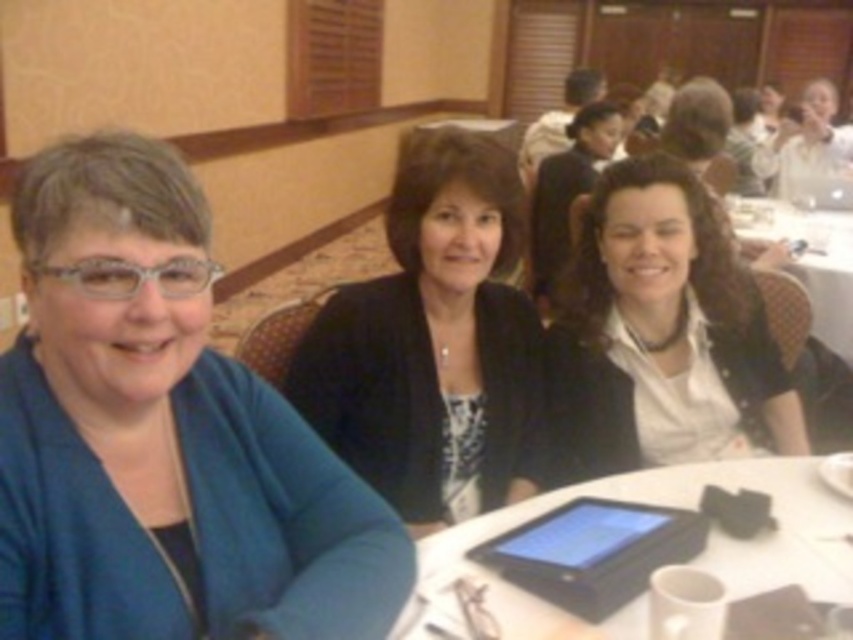
Question: Among these points, which one is farthest from the camera?

Choices:
 (A) (492, 140)
 (B) (596, 300)

Answer: (B)

Question: Can you confirm if black matte blazer at center is smaller than matte black jacket at center?

Choices:
 (A) yes
 (B) no

Answer: (A)

Question: Which object is closer to the camera taking this photo?

Choices:
 (A) white glossy hair at upper right
 (B) white matte shirt at center
 (C) white glossy table at center

Answer: (B)

Question: Is black matte tablet at center above matte black jacket at center?

Choices:
 (A) no
 (B) yes

Answer: (A)

Question: Is matte black jacket at center thinner than white glossy hair at upper right?

Choices:
 (A) no
 (B) yes

Answer: (B)

Question: Among these objects, which one is farthest from the camera?

Choices:
 (A) white matte shirt at center
 (B) white glossy table at lower center
 (C) matte black jacket at center

Answer: (C)